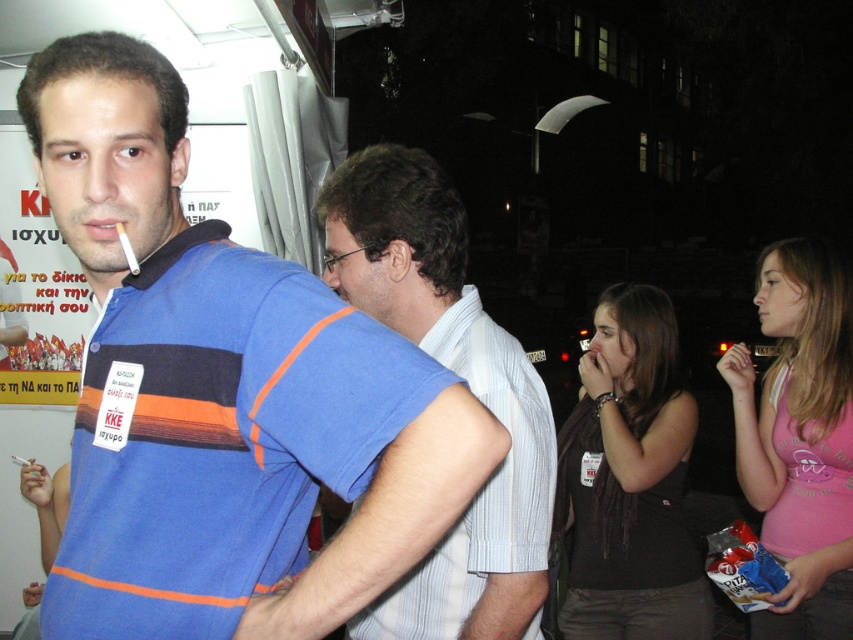
Looking at this image, you are a photographer trying to capture a group photo of the striped cotton shirt at center and the pink cotton tank top at lower right. Based on their positions, which clothing item is positioned more to the right side of the scene?

The pink cotton tank top at lower right is positioned more to the right side of the scene than the striped cotton shirt at center.

You are a photographer standing at the edge of the crowd. You want to take a photo that includes both the striped cotton shirt at center and the dark brown fabric tank top at center without any obstruction. Given that your camera has a maximum focus range of 30 inches, will you be able to capture both subjects in focus?

The distance between the striped cotton shirt at center and the dark brown fabric tank top at center is 31.16 inches, which exceeds the camera maximum focus range of 30 inches. Therefore, you cannot capture both subjects in focus.

You are a photographer standing at the center of the scene. You want to capture a photo that includes both the striped cotton shirt at center and the pink cotton tank top at lower right. Given that your camera has a 30 inch wide lens, will you be able to fit both objects into the frame without moving closer or further away?

The distance between the striped cotton shirt at center and the pink cotton tank top at lower right is 38.44 inches. Since the camera lens can only capture 30 inches wide, the two objects are too far apart to fit within the frame without adjusting your position.